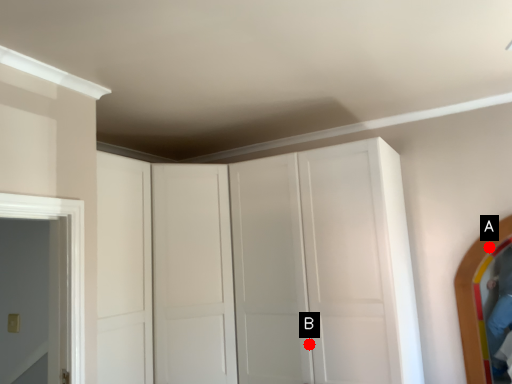
Question: Two points are circled on the image, labeled by A and B beside each circle. Which point is closer to the camera?

Choices:
 (A) A is closer
 (B) B is closer

Answer: (B)